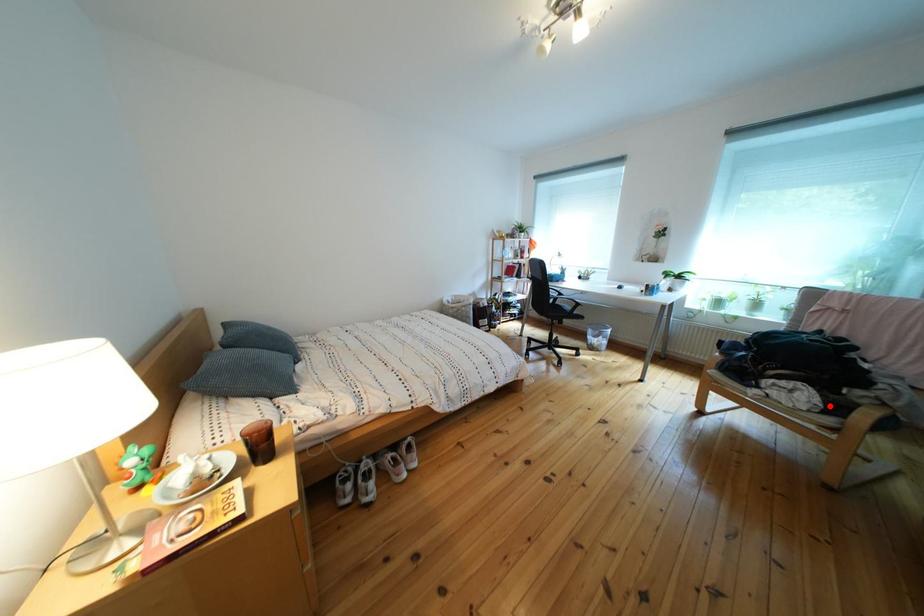
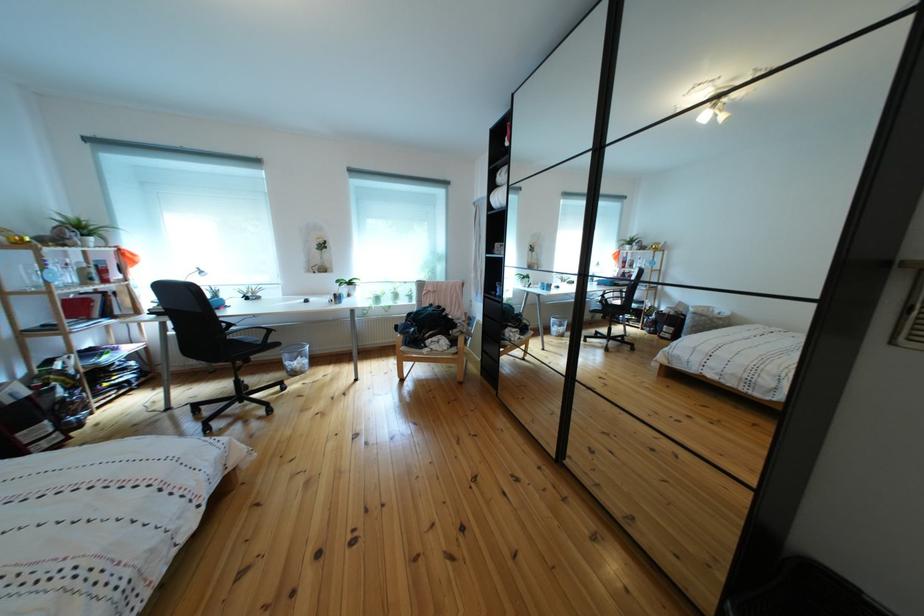
The point at the highlighted location is marked in the first image. Where is the corresponding point in the second image?

(458, 347)